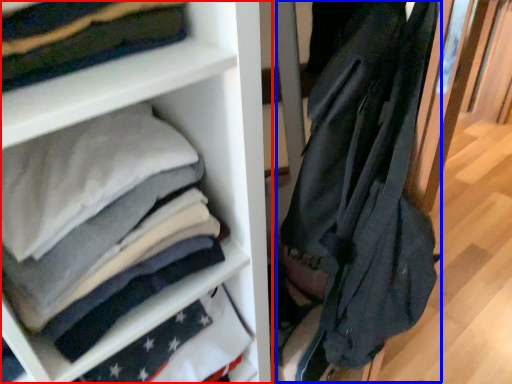
Question: Which of the following is the farthest to the observer, shelf (highlighted by a red box) or garment (highlighted by a blue box)?

Choices:
 (A) shelf
 (B) garment

Answer: (A)